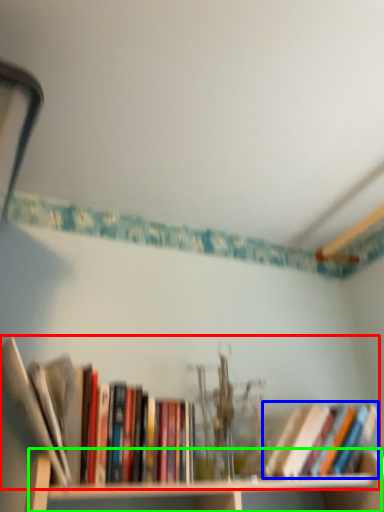
Question: Based on their relative distances, which object is nearer to book (highlighted by a red box)? Choose from book (highlighted by a blue box) and cabinet (highlighted by a green box).

Choices:
 (A) book
 (B) cabinet

Answer: (B)